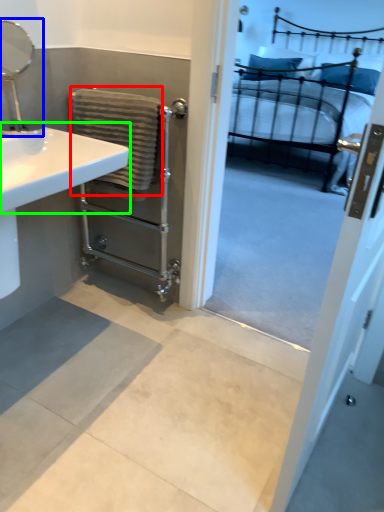
Question: Which is farther away from bath towel (highlighted by a red box)? mirror (highlighted by a blue box) or counter top (highlighted by a green box)?

Choices:
 (A) mirror
 (B) counter top

Answer: (A)